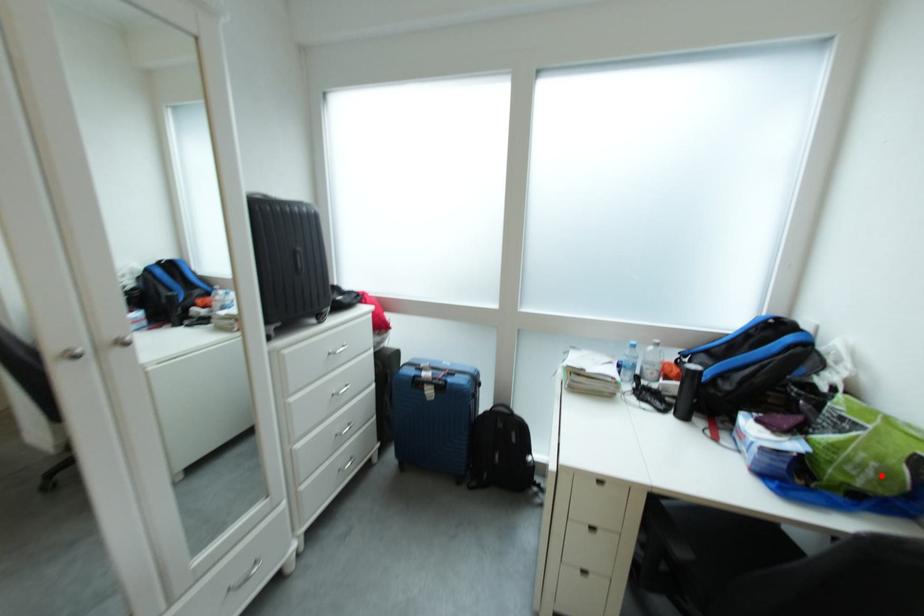
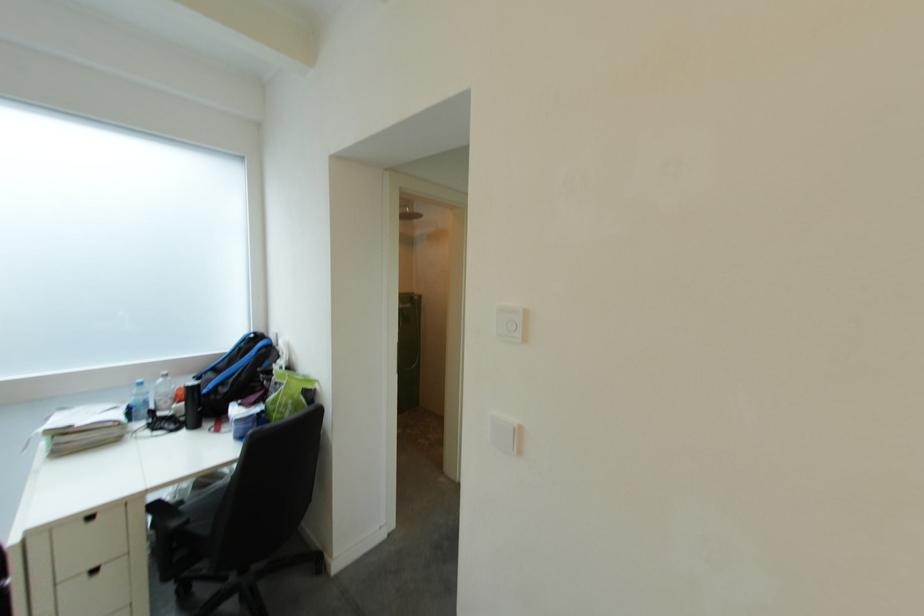
Question: A red point is marked in image1. In image2, is the corresponding 3D point closer to the camera or farther? Reply with the corresponding letter.

Choices:
 (A) The corresponding 3D point is closer.
 (B) The corresponding 3D point is farther.

Answer: (B)